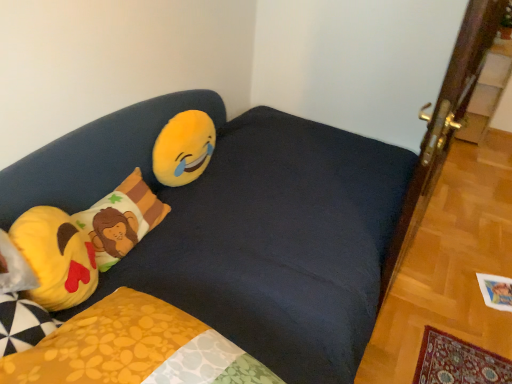
Question: Is yellow plush emoji at upper left surrounded by fluffy cotton pillow with lion design at left, placed as the 1th pillow when sorted from back to front?

Choices:
 (A) yes
 (B) no

Answer: (B)

Question: Is fluffy cotton pillow with lion design at left, acting as the 2th pillow starting from the front, in front of yellow plush emoji at upper left?

Choices:
 (A) yes
 (B) no

Answer: (A)

Question: Is fluffy cotton pillow with lion design at left, acting as the 2th pillow starting from the front, at the left side of yellow plush emoji at upper left?

Choices:
 (A) yes
 (B) no

Answer: (A)

Question: Is fluffy cotton pillow with lion design at left, acting as the 2th pillow starting from the front, positioned with its back to yellow plush emoji at upper left?

Choices:
 (A) yes
 (B) no

Answer: (B)

Question: Can you confirm if fluffy cotton pillow with lion design at left, placed as the 1th pillow when sorted from back to front, is wider than yellow plush emoji at upper left?

Choices:
 (A) yes
 (B) no

Answer: (A)

Question: Relative to yellow plush emoji at upper left, is dark blue fabric studio couch at upper left in front or behind?

Choices:
 (A) front
 (B) behind

Answer: (A)

Question: Considering the positions of point (258, 241) and point (194, 127), is point (258, 241) closer or farther from the camera than point (194, 127)?

Choices:
 (A) closer
 (B) farther

Answer: (A)

Question: From the image's perspective, is dark blue fabric studio couch at upper left positioned above or below yellow plush emoji at upper left?

Choices:
 (A) above
 (B) below

Answer: (B)

Question: Would you say dark blue fabric studio couch at upper left is inside or outside yellow plush emoji at upper left?

Choices:
 (A) inside
 (B) outside

Answer: (B)

Question: From the image's perspective, is yellow plush emoji at left, the 2th pillow viewed from the back, located above or below dark blue fabric studio couch at upper left?

Choices:
 (A) above
 (B) below

Answer: (B)

Question: Is yellow plush emoji at left, which is the 1th pillow in front-to-back order, to the left or to the right of dark blue fabric studio couch at upper left in the image?

Choices:
 (A) left
 (B) right

Answer: (A)

Question: Would you say yellow plush emoji at left, the 2th pillow viewed from the back, is inside or outside dark blue fabric studio couch at upper left?

Choices:
 (A) inside
 (B) outside

Answer: (A)

Question: Relative to dark blue fabric studio couch at upper left, is yellow plush emoji at left, which is the 1th pillow in front-to-back order, in front or behind?

Choices:
 (A) behind
 (B) front

Answer: (A)

Question: From a real-world perspective, is yellow plush emoji at left, the 2th pillow viewed from the back, physically located above or below yellow plush emoji at upper left?

Choices:
 (A) above
 (B) below

Answer: (A)

Question: In the image, is yellow plush emoji at left, which is the 1th pillow in front-to-back order, positioned in front of or behind yellow plush emoji at upper left?

Choices:
 (A) behind
 (B) front

Answer: (B)